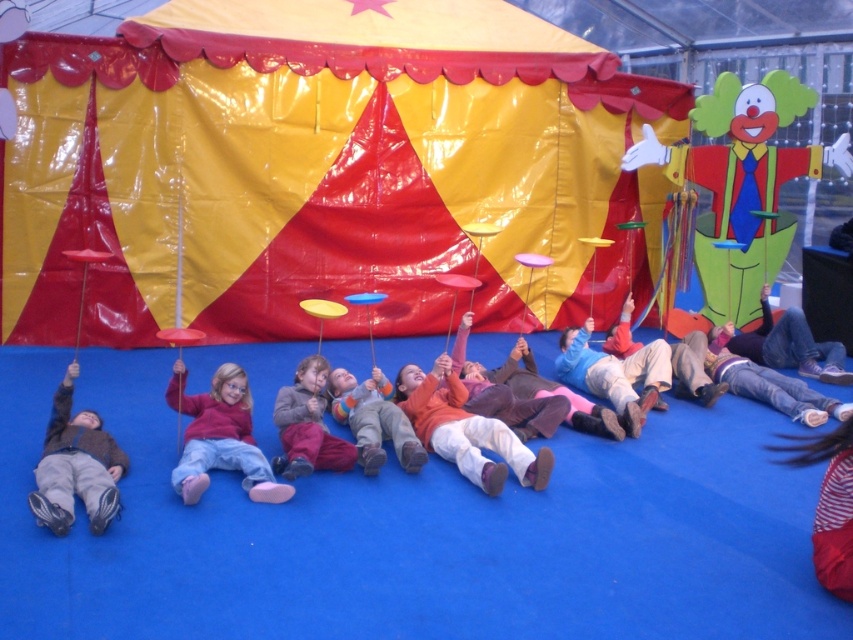
Does matte gray sweater at center have a larger size compared to denim jeans at lower right?

Actually, matte gray sweater at center might be smaller than denim jeans at lower right.

Where is `matte gray sweater at center`? matte gray sweater at center is located at coordinates (306, 424).

Who is more forward, [323,369] or [834,376]?

Point [323,369] is more forward.

Find the location of a particular element. This screenshot has width=853, height=640. matte gray sweater at center is located at coordinates (306, 424).

Does point (355, 177) lie in front of point (462, 419)?

No, (355, 177) is behind (462, 419).

Is yellow/red fabric tent at upper center smaller than orange sweater at center?

No, yellow/red fabric tent at upper center is not smaller than orange sweater at center.

What do you see at coordinates (311, 164) in the screenshot? This screenshot has width=853, height=640. I see `yellow/red fabric tent at upper center` at bounding box center [311, 164].

Identify the location of yellow/red fabric tent at upper center. (311, 164).

Which of these two, yellow/red fabric tent at upper center or orange fleece sweater at center, stands shorter?

orange fleece sweater at center

Does yellow/red fabric tent at upper center have a greater width compared to orange fleece sweater at center?

Indeed, yellow/red fabric tent at upper center has a greater width compared to orange fleece sweater at center.

Based on the photo, who is more forward, (482, 314) or (376, 428)?

Point (376, 428)

I want to click on yellow/red fabric tent at upper center, so click(311, 164).